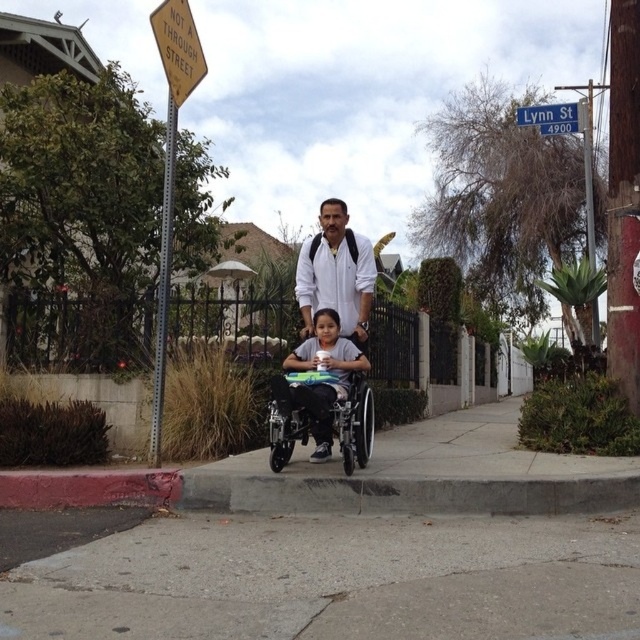
You are a pedestrian trying to determine if you can see both the white matte shirt at center and the blue plastic street sign at upper center from your current position. Based on their sizes, which object would appear closer to you?

The white matte shirt at center appears closer because it is larger in size than the blue plastic street sign at upper center.

You are a delivery person trying to navigate Lynn Street. You see the gray concrete sidewalk at lower center and the white matte shirt at center. Which one is bigger in size?

The gray concrete sidewalk at lower center is larger in size than the white matte shirt at center.